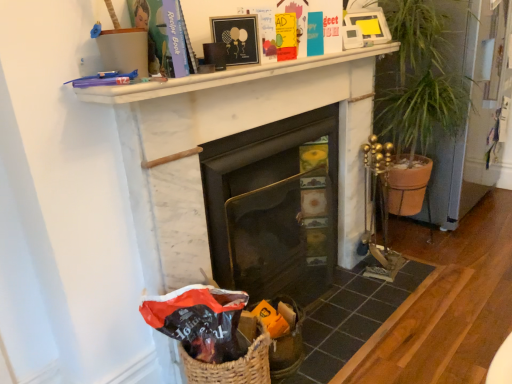
Question: Is green leafy plant at right positioned with its back to black glass fireplace at center, the first fireplace in the left-to-right sequence?

Choices:
 (A) yes
 (B) no

Answer: (B)

Question: Is green leafy plant at right not near black glass fireplace at center, positioned as the 2th fireplace in right-to-left order?

Choices:
 (A) yes
 (B) no

Answer: (B)

Question: Would you say green leafy plant at right is outside black glass fireplace at center, the first fireplace in the left-to-right sequence?

Choices:
 (A) yes
 (B) no

Answer: (A)

Question: From the image's perspective, does green leafy plant at right appear higher than black glass fireplace at center, positioned as the 2th fireplace in right-to-left order?

Choices:
 (A) yes
 (B) no

Answer: (A)

Question: Can you confirm if green leafy plant at right is wider than black glass fireplace at center, the first fireplace in the left-to-right sequence?

Choices:
 (A) no
 (B) yes

Answer: (B)

Question: From the image's perspective, is matte black picture frame at upper center above or below matte black gift bag at lower left?

Choices:
 (A) below
 (B) above

Answer: (B)

Question: Is matte black picture frame at upper center inside or outside of matte black gift bag at lower left?

Choices:
 (A) inside
 (B) outside

Answer: (B)

Question: Is matte black picture frame at upper center taller or shorter than matte black gift bag at lower left?

Choices:
 (A) tall
 (B) short

Answer: (B)

Question: Looking at their shapes, would you say matte black picture frame at upper center is wider or thinner than matte black gift bag at lower left?

Choices:
 (A) thin
 (B) wide

Answer: (A)

Question: Looking at their shapes, would you say black glass fireplace at center, positioned as the 2th fireplace in right-to-left order, is wider or thinner than green leafy plant at right?

Choices:
 (A) wide
 (B) thin

Answer: (B)

Question: Is black glass fireplace at center, positioned as the 2th fireplace in right-to-left order, inside the boundaries of green leafy plant at right, or outside?

Choices:
 (A) inside
 (B) outside

Answer: (B)

Question: Is point (310, 288) positioned closer to the camera than point (418, 79)?

Choices:
 (A) closer
 (B) farther

Answer: (A)

Question: Is black glass fireplace at center, positioned as the 2th fireplace in right-to-left order, bigger or smaller than green leafy plant at right?

Choices:
 (A) big
 (B) small

Answer: (B)

Question: Is matte black gift bag at lower left spatially inside black glass fireplace at center, the first fireplace in the left-to-right sequence, or outside of it?

Choices:
 (A) outside
 (B) inside

Answer: (A)

Question: Considering the positions of matte black gift bag at lower left and black glass fireplace at center, positioned as the 2th fireplace in right-to-left order, in the image, is matte black gift bag at lower left wider or thinner than black glass fireplace at center, positioned as the 2th fireplace in right-to-left order,?

Choices:
 (A) thin
 (B) wide

Answer: (B)